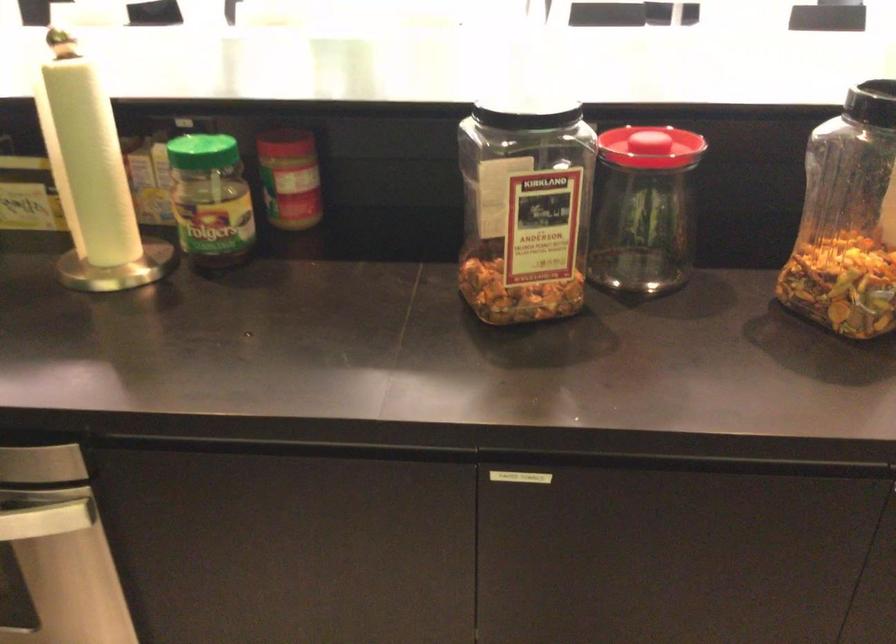
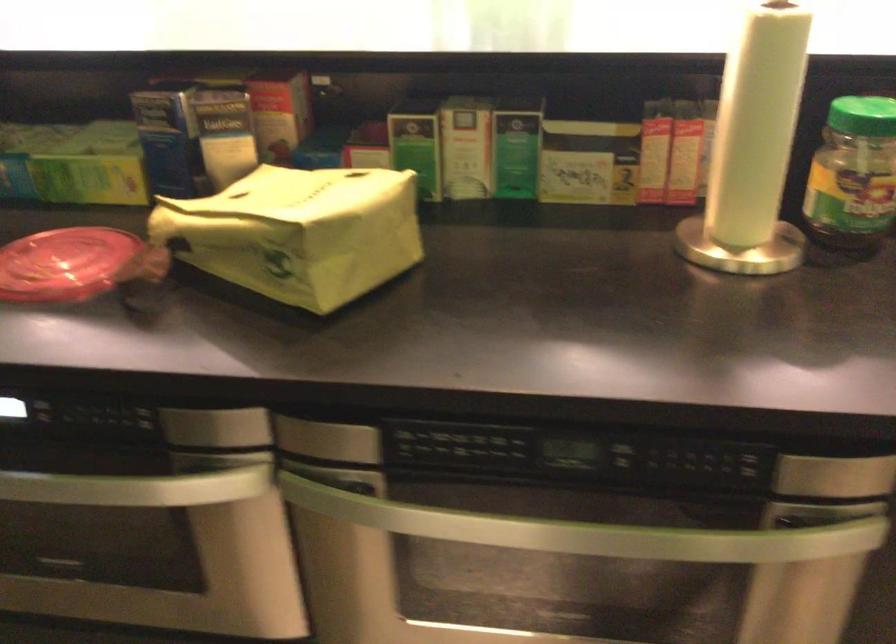
Question: What movement of the cameraman would produce the second image?

Choices:
 (A) Left
 (B) Right
 (C) Forward
 (D) Backward

Answer: (A)